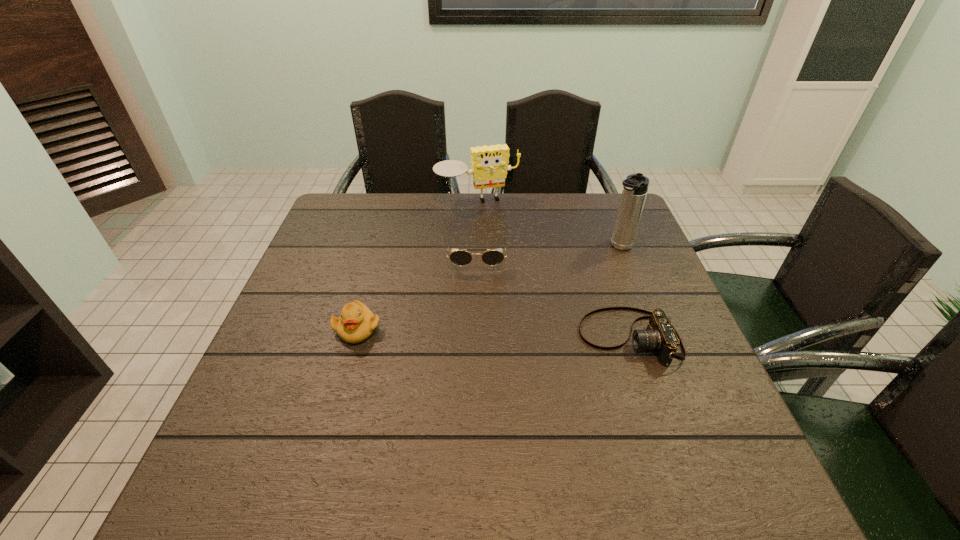
The height and width of the screenshot is (540, 960). I want to click on free location that satisfies the following two spatial constraints: 1. on the front side of the camera; 2. on the front-facing side of the sunglasses, so click(x=476, y=338).

What are the coordinates of `vacant space that satisfies the following two spatial constraints: 1. on the back side of the sunglasses; 2. on the right side of the thermos bottle` in the screenshot? It's located at (477, 247).

Identify the location of vacant space that satisfies the following two spatial constraints: 1. at the beak of the duckling; 2. on the front-facing side of the shortest object. (355, 338).